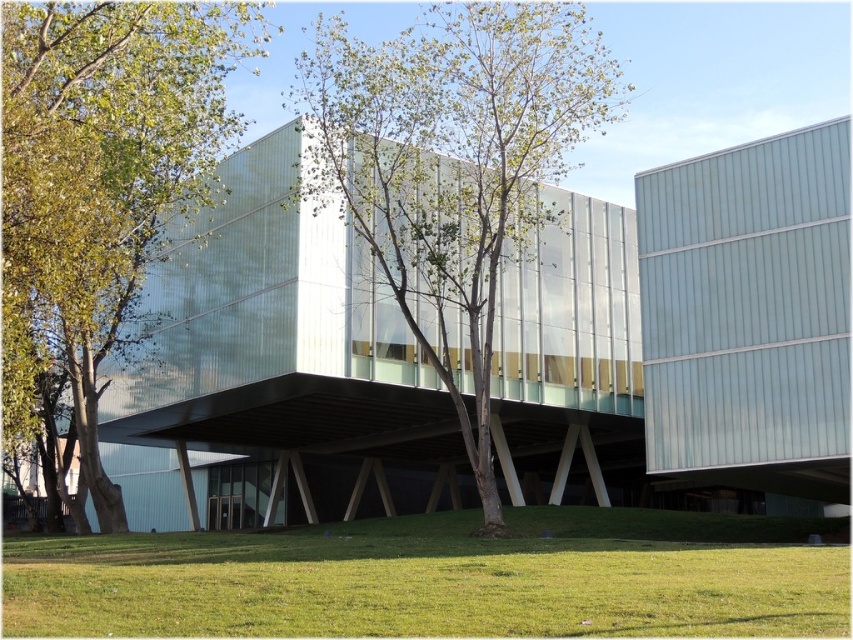
Does green grass at lower center appear under green leafy tree at center?

Indeed, green grass at lower center is positioned under green leafy tree at center.

Is point (280, 560) positioned in front of point (469, 148)?

Yes.

You are a GUI agent. You are given a task and a screenshot of the screen. Output one action in this format:
    pyautogui.click(x=<x>, y=<y>)
    Task: Click on the green grass at lower center
    This screenshot has width=853, height=640.
    Given the screenshot: What is the action you would take?
    pyautogui.click(x=440, y=579)

Is green leafy tree at center thinner than green leafy tree at left?

In fact, green leafy tree at center might be wider than green leafy tree at left.

Locate an element on the screen. This screenshot has height=640, width=853. green leafy tree at center is located at coordinates (451, 164).

At what (x,y) coordinates should I click in order to perform the action: click on green leafy tree at center. Please return your answer as a coordinate pair (x, y). The height and width of the screenshot is (640, 853). Looking at the image, I should click on (451, 164).

Can you confirm if green grass at lower center is shorter than green leafy tree at left?

Indeed, green grass at lower center has a lesser height compared to green leafy tree at left.

Does green grass at lower center have a smaller size compared to green leafy tree at left?

Yes.

Measure the distance between point (405,598) and camera.

Point (405,598) is 17.33 meters away from camera.

Locate an element on the screen. The height and width of the screenshot is (640, 853). green grass at lower center is located at coordinates (440, 579).